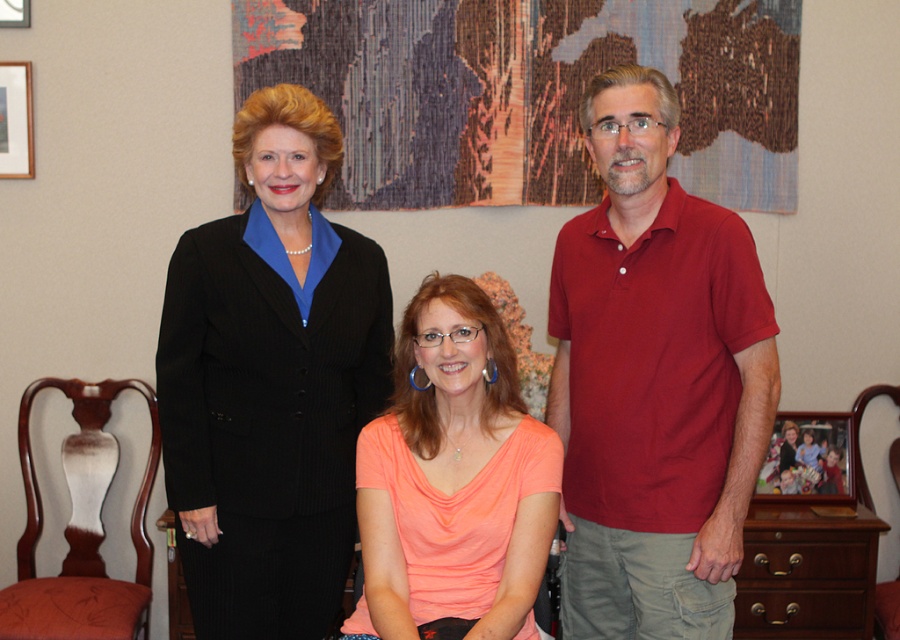
Does mahogany wood chair at lower left appear over wooden picture frame at upper center?

No.

Can you confirm if mahogany wood chair at lower left is wider than wooden picture frame at upper center?

Indeed, mahogany wood chair at lower left has a greater width compared to wooden picture frame at upper center.

Describe the element at coordinates (81, 529) in the screenshot. I see `mahogany wood chair at lower left` at that location.

Where is `mahogany wood chair at lower left`? The height and width of the screenshot is (640, 900). mahogany wood chair at lower left is located at coordinates (81, 529).

Does matte red polo shirt at center appear on the left side of black pinstripe suit at upper left?

No, matte red polo shirt at center is not to the left of black pinstripe suit at upper left.

Which is behind, point (702, 328) or point (303, 460)?

The point (303, 460) is behind.

Where is `matte red polo shirt at center`? The image size is (900, 640). matte red polo shirt at center is located at coordinates (654, 381).

Is brown wood dresser at lower right taller than wooden picture frame at center?

Yes.

Can you confirm if brown wood dresser at lower right is smaller than wooden picture frame at center?

No.

Where is `brown wood dresser at lower right`? brown wood dresser at lower right is located at coordinates (806, 572).